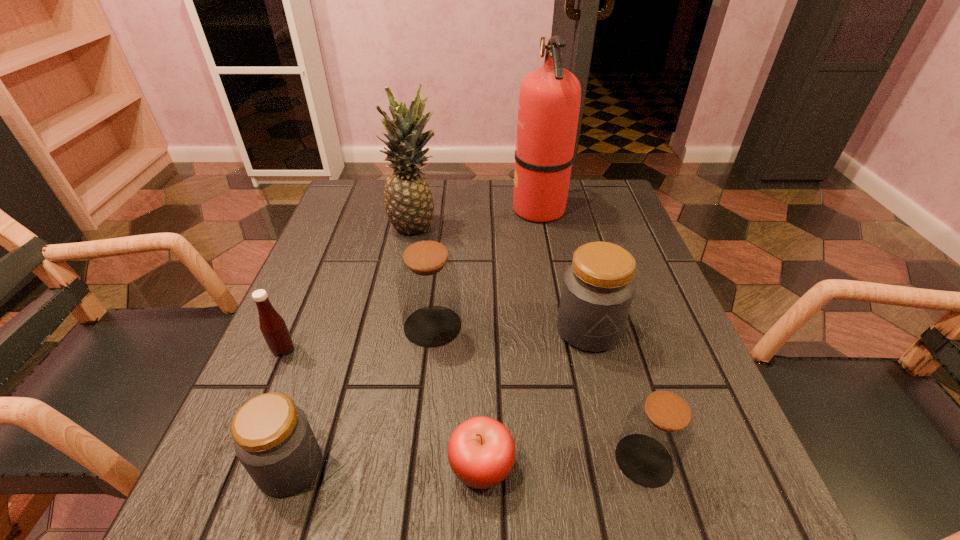
You are a GUI agent. You are given a task and a screenshot of the screen. Output one action in this format:
    pyautogui.click(x=<x>, y=<y>)
    Task: Click on the free location located on the front of the left brown jar
    This screenshot has width=960, height=540.
    Given the screenshot: What is the action you would take?
    pyautogui.click(x=415, y=489)

At what (x,y) coordinates should I click in order to perform the action: click on vacant area situated 0.050m on the surface of the farther gray jar near the warning symbol. Please return your answer as a coordinate pair (x, y). This screenshot has width=960, height=540. Looking at the image, I should click on (600, 377).

Find the location of a particular element. The width and height of the screenshot is (960, 540). free point located 0.100m on the back of the Tabasco sauce is located at coordinates (302, 304).

Locate an element on the screen. free space located on the surface of the leftmost jar near the warning symbol is located at coordinates (437, 467).

Find the location of `free space located 0.060m on the front of the nearer brown jar`. free space located 0.060m on the front of the nearer brown jar is located at coordinates (665, 535).

Where is `vacant area located 0.310m on the back of the red apple`? The image size is (960, 540). vacant area located 0.310m on the back of the red apple is located at coordinates (481, 299).

The image size is (960, 540). I want to click on fire extinguisher at the far edge, so coord(549,102).

At what (x,y) coordinates should I click in order to perform the action: click on pineapple at the far edge. Please return your answer as a coordinate pair (x, y). Image resolution: width=960 pixels, height=540 pixels. Looking at the image, I should click on (409, 205).

Find the location of a particular element. The height and width of the screenshot is (540, 960). apple that is at the near edge is located at coordinates (x=481, y=452).

The image size is (960, 540). I want to click on pineapple present at the left edge, so click(409, 205).